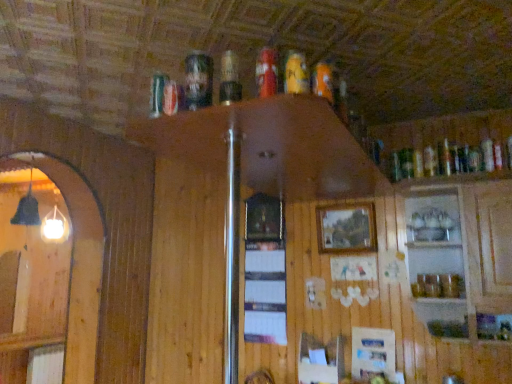
Question: Should I look upward or downward to see wooden picture frame at center?

Choices:
 (A) up
 (B) down

Answer: (B)

Question: Considering the relative positions of orange matte can at upper center, which appears as the fourth beer when viewed from the left, and matte plastic beer can at upper center, placed as the 2th beer when sorted from left to right, in the image provided, is orange matte can at upper center, which appears as the fourth beer when viewed from the left, in front of matte plastic beer can at upper center, placed as the 2th beer when sorted from left to right,?

Choices:
 (A) no
 (B) yes

Answer: (B)

Question: Considering the relative sizes of orange matte can at upper center, which appears as the fourth beer when viewed from the left, and matte plastic beer can at upper center, which ranks as the 3th beer in right-to-left order, in the image provided, is orange matte can at upper center, which appears as the fourth beer when viewed from the left, smaller than matte plastic beer can at upper center, which ranks as the 3th beer in right-to-left order,?

Choices:
 (A) no
 (B) yes

Answer: (B)

Question: Is orange matte can at upper center, the 1th beer from the right, positioned with its back to matte plastic beer can at upper center, placed as the 2th beer when sorted from left to right?

Choices:
 (A) no
 (B) yes

Answer: (A)

Question: Does orange matte can at upper center, the 1th beer from the right, have a lesser width compared to matte plastic beer can at upper center, which ranks as the 3th beer in right-to-left order?

Choices:
 (A) no
 (B) yes

Answer: (A)

Question: Can you confirm if orange matte can at upper center, which appears as the fourth beer when viewed from the left, is shorter than matte plastic beer can at upper center, placed as the 2th beer when sorted from left to right?

Choices:
 (A) no
 (B) yes

Answer: (B)

Question: From a real-world perspective, is orange matte can at upper center, which appears as the fourth beer when viewed from the left, on matte plastic beer can at upper center, which ranks as the 3th beer in right-to-left order?

Choices:
 (A) yes
 (B) no

Answer: (B)

Question: Is wooden picture frame at center at the left side of orange matte can at upper center, the 1th beer from the right?

Choices:
 (A) yes
 (B) no

Answer: (B)

Question: Is orange matte can at upper center, the 1th beer from the right, located within wooden picture frame at center?

Choices:
 (A) no
 (B) yes

Answer: (A)

Question: From a real-world perspective, is wooden picture frame at center physically below orange matte can at upper center, the 1th beer from the right?

Choices:
 (A) no
 (B) yes

Answer: (B)

Question: Does wooden picture frame at center have a greater height compared to orange matte can at upper center, which appears as the fourth beer when viewed from the left?

Choices:
 (A) no
 (B) yes

Answer: (B)

Question: Is wooden picture frame at center closer to camera compared to orange matte can at upper center, the 1th beer from the right?

Choices:
 (A) no
 (B) yes

Answer: (A)

Question: Considering the relative positions of wooden picture frame at center and orange matte can at upper center, which appears as the fourth beer when viewed from the left, in the image provided, is wooden picture frame at center behind orange matte can at upper center, which appears as the fourth beer when viewed from the left,?

Choices:
 (A) yes
 (B) no

Answer: (A)

Question: From a real-world perspective, is orange matte can at upper center, which appears as the fourth beer when viewed from the left, located higher than clear glass cabinet at upper right?

Choices:
 (A) no
 (B) yes

Answer: (B)